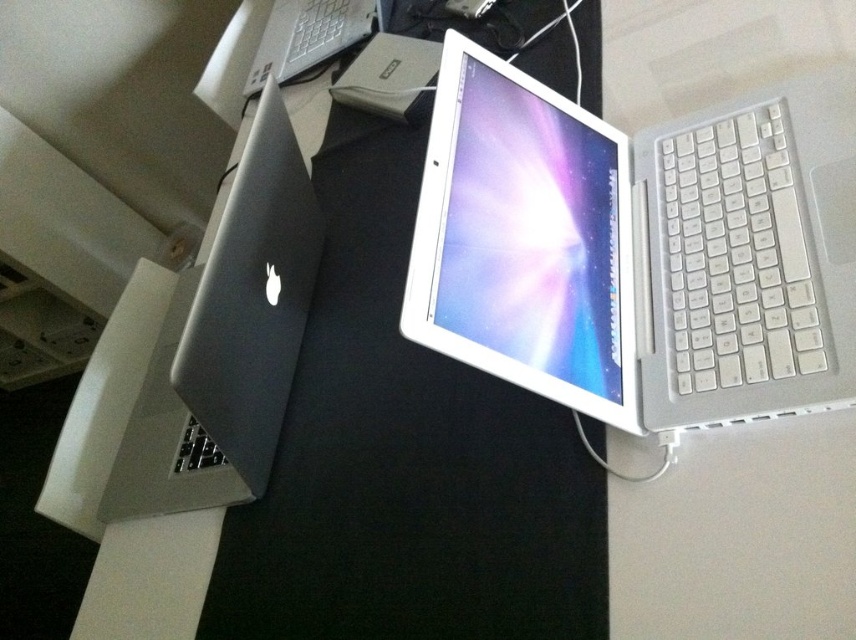
Between point (113, 464) and point (343, 38), which one is positioned in front?

Point (113, 464)

Is satin silver laptop at left shorter than white plastic laptop at upper center?

Incorrect, satin silver laptop at left's height does not fall short of white plastic laptop at upper center's.

Is point (266, 156) farther from camera compared to point (330, 12)?

No, (266, 156) is closer to viewer.

At what (x,y) coordinates should I click in order to perform the action: click on satin silver laptop at left. Please return your answer as a coordinate pair (x, y). Looking at the image, I should click on (226, 340).

Who is positioned more to the right, white plastic keyboard at right or white plastic laptop at upper center?

From the viewer's perspective, white plastic keyboard at right appears more on the right side.

Is white plastic keyboard at right closer to the viewer compared to white plastic laptop at upper center?

Yes, white plastic keyboard at right is in front of white plastic laptop at upper center.

Is point (813, 301) closer to camera compared to point (339, 42)?

Yes.

Image resolution: width=856 pixels, height=640 pixels. I want to click on white plastic keyboard at right, so [738, 256].

Who is positioned more to the right, satin silver laptop at left or white plastic keyboard at right?

white plastic keyboard at right is more to the right.

Locate an element on the screen. The height and width of the screenshot is (640, 856). satin silver laptop at left is located at coordinates (226, 340).

Where is `satin silver laptop at left`? satin silver laptop at left is located at coordinates [226, 340].